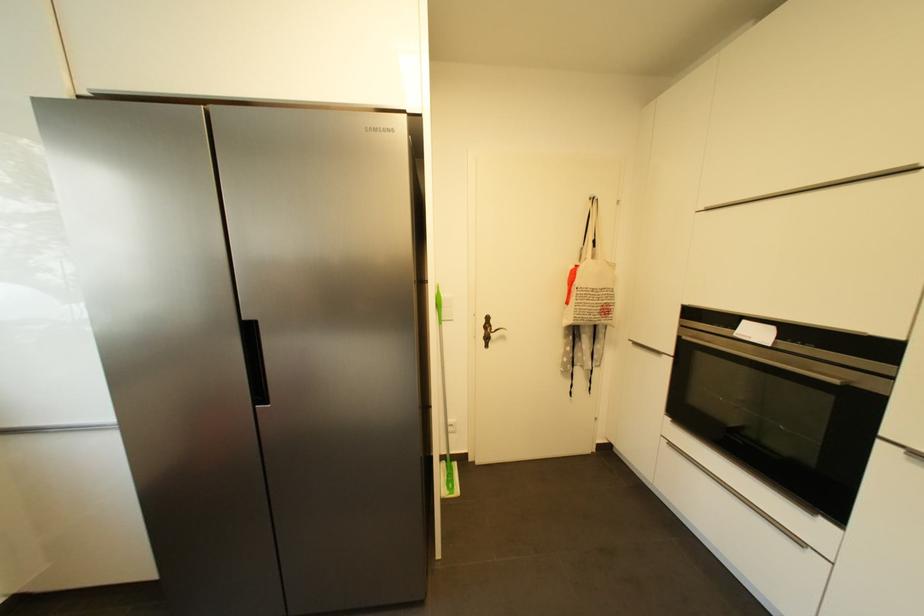
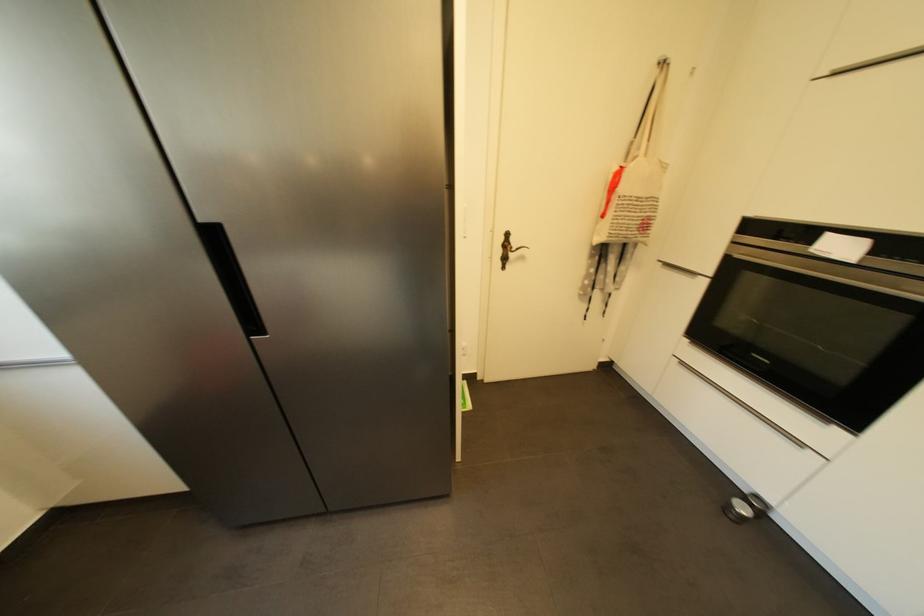
Question: The first image is from the beginning of the video and the second image is from the end. How did the camera likely rotate when shooting the video?

Choices:
 (A) Left
 (B) Right
 (C) Up
 (D) Down

Answer: (D)